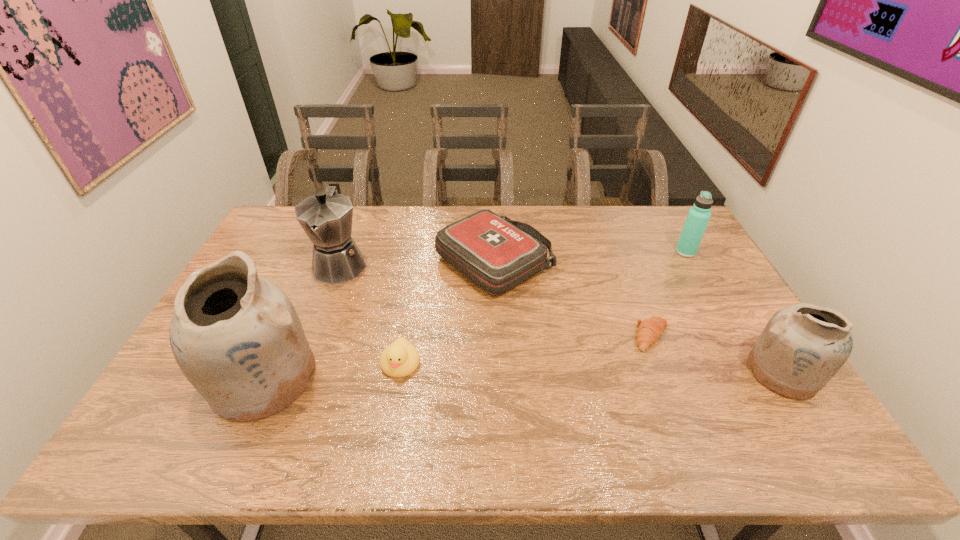
To make them evenly spaced by inserting another pottery among them, please locate a free space for this new pottery. Please provide its 2D coordinates. Your answer should be formatted as a tuple, i.e. [(x, y)], where the tuple contains the x and y coordinates of a point satisfying the conditions above.

[(525, 375)]